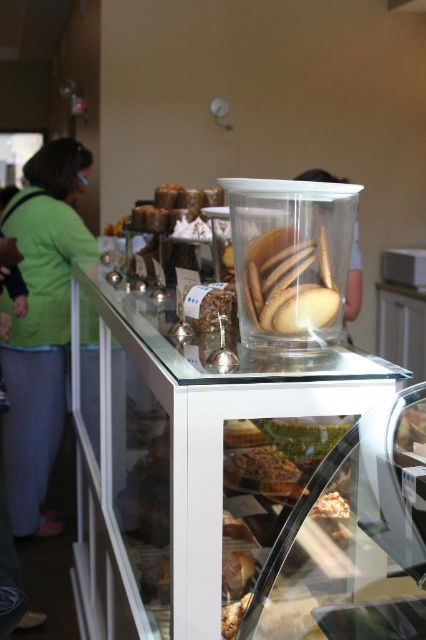
You are a customer in the bakery and want to grab both the crumbly brown pastry at center and the matte brown bread at upper center. Which one should you reach for first to get the one closer to you?

The crumbly brown pastry at center is closer to you since it is below the matte brown bread at upper center, meaning it is positioned lower and nearer in the display.

Looking at this image, you are a customer at the bakery and want to choose between the crumbly brown pastry at center and the matte brown bread at upper center. Which one is located to the right of the other?

The crumbly brown pastry at center is positioned on the right side of matte brown bread at upper center.

You are a customer looking at the display counter in the bakery. You see the matte brown bread at upper center and the translucent glass cookies at center. Which item is located above the other?

The matte brown bread at upper center is positioned over the translucent glass cookies at center, so it is above the cookies.